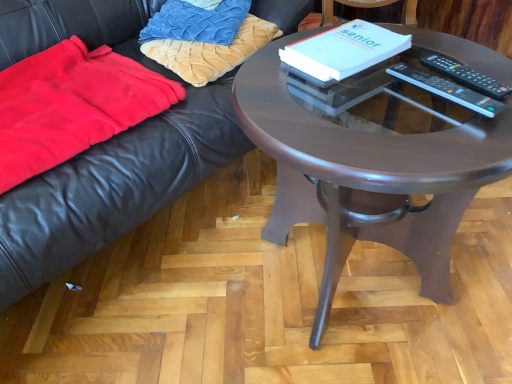
Question: Considering the relative positions of black leather couch at upper left and velvet gold pillow at upper left, positioned as the first pillow in bottom-to-top order, in the image provided, is black leather couch at upper left to the left or to the right of velvet gold pillow at upper left, positioned as the first pillow in bottom-to-top order,?

Choices:
 (A) right
 (B) left

Answer: (B)

Question: Considering the positions of black leather couch at upper left and velvet gold pillow at upper left, which is the 2th pillow in top-to-bottom order, in the image, is black leather couch at upper left wider or thinner than velvet gold pillow at upper left, which is the 2th pillow in top-to-bottom order,?

Choices:
 (A) wide
 (B) thin

Answer: (A)

Question: Estimate the real-world distances between objects in this image. Which object is closer to the velvet gold pillow at upper left, which is the 2th pillow in top-to-bottom order?

Choices:
 (A) black plastic remote control at upper right, which is the 2th remote control in left-to-right order
 (B) black leather couch at upper left
 (C) velvet blue pillow at upper left, the second pillow from the bottom
 (D) white paper at center
 (E) black plastic remote control at right, which is counted as the first remote control, starting from the left

Answer: (C)

Question: Considering the real-world distances, which object is closest to the black plastic remote control at upper right, which is the 2th remote control in left-to-right order?

Choices:
 (A) red fleece blanket at left
 (B) black plastic remote control at right, positioned as the 2th remote control in right-to-left order
 (C) matte brown table at center
 (D) black leather couch at upper left
 (E) velvet blue pillow at upper left, which is the 1th pillow in top-to-bottom order

Answer: (B)